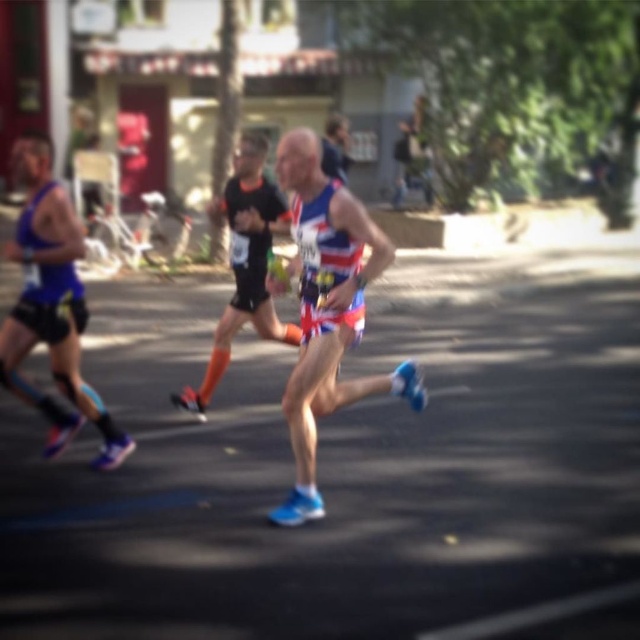
Can you confirm if matte blue shorts at center is bigger than reflective blue shorts at center?

Yes.

Is point (378, 385) positioned before point (237, 268)?

Yes.

The height and width of the screenshot is (640, 640). In order to click on matte blue shorts at center in this screenshot , I will do coord(326,308).

Is matte blue tank top at left below reflective blue shorts at center?

Yes, matte blue tank top at left is below reflective blue shorts at center.

Which of these two, matte blue tank top at left or reflective blue shorts at center, stands shorter?

Standing shorter between the two is matte blue tank top at left.

Between point (61, 314) and point (284, 333), which one is positioned behind?

Point (284, 333)

The height and width of the screenshot is (640, 640). I want to click on matte blue tank top at left, so click(x=51, y=305).

Which is more to the right, matte blue shorts at center or matte blue tank top at left?

From the viewer's perspective, matte blue shorts at center appears more on the right side.

Does matte blue shorts at center have a greater height compared to matte blue tank top at left?

Yes.

Locate an element on the screen. The width and height of the screenshot is (640, 640). matte blue shorts at center is located at coordinates tap(326, 308).